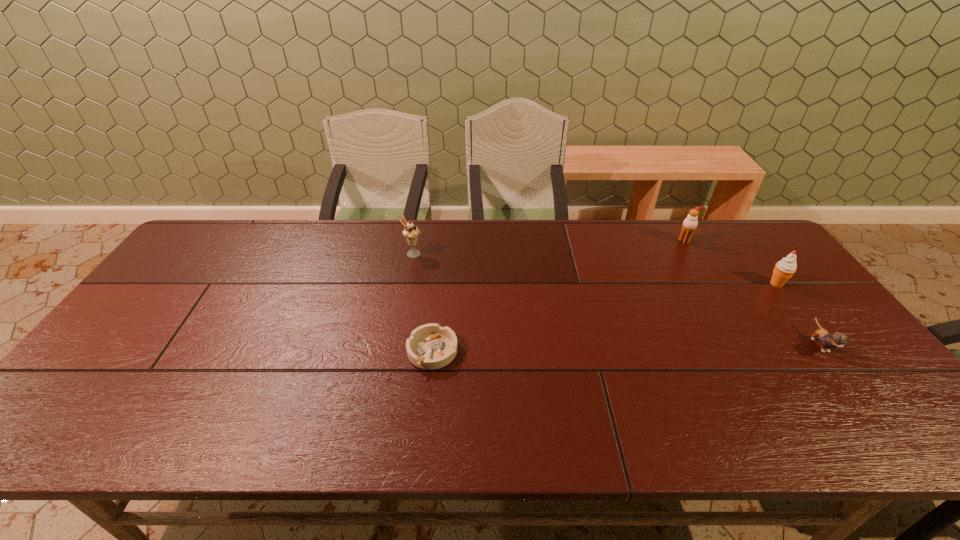
Where is `the closest object to the leftmost object`? Image resolution: width=960 pixels, height=540 pixels. the closest object to the leftmost object is located at coordinates (430, 346).

Image resolution: width=960 pixels, height=540 pixels. In order to click on object identified as the closest to the leftmost object in this screenshot , I will do `click(430, 346)`.

This screenshot has width=960, height=540. Identify the location of the closest icecream to the second object from left to right. (411, 232).

Identify which icecream is the second closest to the leftmost icecream. Please provide its 2D coordinates. Your answer should be formatted as a tuple, i.e. [(x, y)], where the tuple contains the x and y coordinates of a point satisfying the conditions above.

[(784, 269)]

Identify the location of free region that satisfies the following two spatial constraints: 1. on the back side of the third nearest object; 2. on the left side of the fourth object from right to left. This screenshot has width=960, height=540. (440, 284).